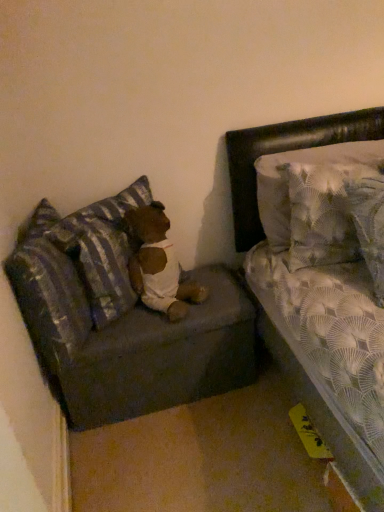
You are a GUI agent. You are given a task and a screenshot of the screen. Output one action in this format:
    pyautogui.click(x=<x>, y=<y>)
    Task: Click on the vacant space that is in between brown plush teddy bear at center and striped fabric pillow at left, which appears as the second pillow when viewed from the right
    This screenshot has width=384, height=512.
    Given the screenshot: What is the action you would take?
    pyautogui.click(x=134, y=327)